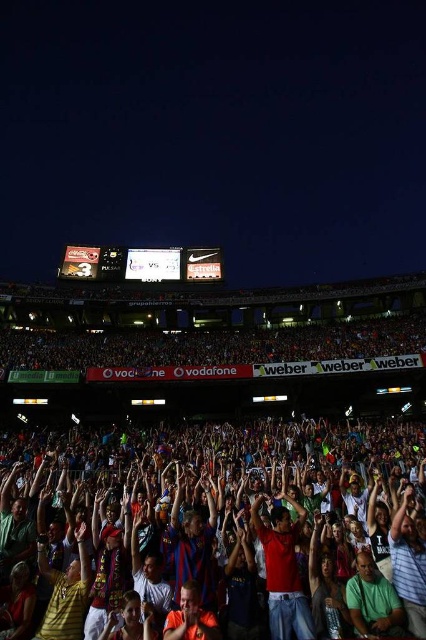
Question: Considering the relative positions of multicolored fabric crowd at lower center and red cotton shirt at center in the image provided, where is multicolored fabric crowd at lower center located with respect to red cotton shirt at center?

Choices:
 (A) above
 (B) below

Answer: (A)

Question: Which point is closer to the camera taking this photo?

Choices:
 (A) (271, 628)
 (B) (178, 442)

Answer: (A)

Question: Is multicolored fabric crowd at lower center above red cotton shirt at center?

Choices:
 (A) yes
 (B) no

Answer: (A)

Question: Considering the relative positions of multicolored fabric crowd at lower center and red cotton shirt at center in the image provided, where is multicolored fabric crowd at lower center located with respect to red cotton shirt at center?

Choices:
 (A) right
 (B) left

Answer: (B)